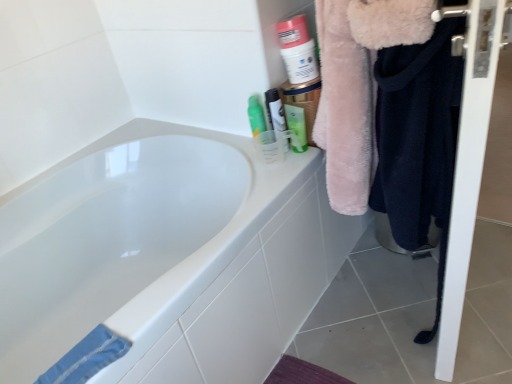
Question: Can you confirm if matte white container at upper right is positioned to the left of translucent plastic cup at upper right, arranged as the 1th mouthwash when viewed from the left?

Choices:
 (A) yes
 (B) no

Answer: (B)

Question: Is the position of matte white container at upper right less distant than that of translucent plastic cup at upper right, arranged as the 1th mouthwash when viewed from the left?

Choices:
 (A) yes
 (B) no

Answer: (A)

Question: Does matte white container at upper right have a greater height compared to translucent plastic cup at upper right, the 2th mouthwash in the right-to-left sequence?

Choices:
 (A) yes
 (B) no

Answer: (B)

Question: From the image's perspective, is matte white container at upper right on top of translucent plastic cup at upper right, the 2th mouthwash in the right-to-left sequence?

Choices:
 (A) yes
 (B) no

Answer: (A)

Question: Is matte white container at upper right shorter than translucent plastic cup at upper right, the 2th mouthwash in the right-to-left sequence?

Choices:
 (A) no
 (B) yes

Answer: (B)

Question: Is translucent plastic cup at upper right, the 2th mouthwash in the right-to-left sequence, inside matte white container at upper right?

Choices:
 (A) no
 (B) yes

Answer: (A)

Question: Is fuzzy pink coat at right at the right side of white glossy bathtub at upper left?

Choices:
 (A) no
 (B) yes

Answer: (B)

Question: Is the surface of fuzzy pink coat at right in direct contact with white glossy bathtub at upper left?

Choices:
 (A) no
 (B) yes

Answer: (A)

Question: Is the position of fuzzy pink coat at right more distant than that of white glossy bathtub at upper left?

Choices:
 (A) yes
 (B) no

Answer: (B)

Question: From a real-world perspective, does fuzzy pink coat at right stand above white glossy bathtub at upper left?

Choices:
 (A) yes
 (B) no

Answer: (A)

Question: Is fuzzy pink coat at right surrounding white glossy bathtub at upper left?

Choices:
 (A) no
 (B) yes

Answer: (A)

Question: From the image's perspective, does fuzzy pink coat at right appear higher than white glossy bathtub at upper left?

Choices:
 (A) yes
 (B) no

Answer: (A)

Question: From a real-world perspective, does white glossy bathtub at upper left stand above white glossy screen door at right?

Choices:
 (A) no
 (B) yes

Answer: (A)